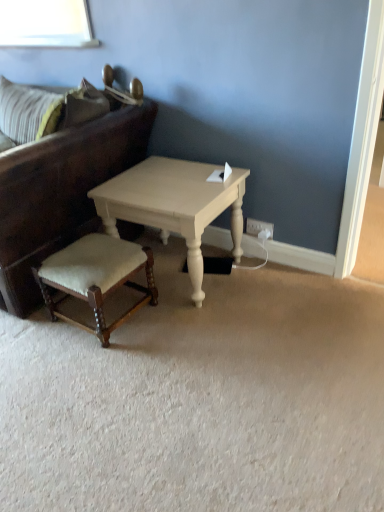
Find the location of a particular element. This screenshot has height=512, width=384. dark brown leather studio couch at left is located at coordinates (65, 181).

Measure the distance between white painted wood coffee table at center and camera.

The depth of white painted wood coffee table at center is 5.34 feet.

Locate an element on the screen. Image resolution: width=384 pixels, height=512 pixels. white plastic electric outlet at lower right is located at coordinates (258, 227).

From the picture: In terms of width, does white plastic electric outlet at lower right look wider or thinner when compared to velvet beige stool at lower left?

Clearly, white plastic electric outlet at lower right has less width compared to velvet beige stool at lower left.

Considering the points (257, 226) and (118, 322), which point is behind, point (257, 226) or point (118, 322)?

The point (257, 226) is behind.

Can you confirm if white plastic electric outlet at lower right is smaller than velvet beige stool at lower left?

Yes, white plastic electric outlet at lower right is smaller than velvet beige stool at lower left.

What's the angular difference between white plastic electric outlet at lower right and velvet beige stool at lower left's facing directions?

The angle between the facing direction of white plastic electric outlet at lower right and the facing direction of velvet beige stool at lower left is 0.702 degrees.

Could you tell me if velvet beige stool at lower left is turned towards white painted wood coffee table at center?

No.

Is velvet beige stool at lower left beside white painted wood coffee table at center?

velvet beige stool at lower left is not next to white painted wood coffee table at center, and they're not touching.

Is velvet beige stool at lower left in front of or behind white painted wood coffee table at center in the image?

In the image, velvet beige stool at lower left appears in front of white painted wood coffee table at center.

Between point (249, 221) and point (64, 184), which one is positioned behind?

Point (249, 221)

From the image's perspective, would you say white plastic electric outlet at lower right is shown under dark brown leather studio couch at left?

Indeed, from the image's perspective, white plastic electric outlet at lower right is shown beneath dark brown leather studio couch at left.

Is white plastic electric outlet at lower right located outside dark brown leather studio couch at left?

That's correct, white plastic electric outlet at lower right is outside of dark brown leather studio couch at left.

From their relative heights in the image, would you say white plastic electric outlet at lower right is taller or shorter than dark brown leather studio couch at left?

Considering their sizes, white plastic electric outlet at lower right has less height than dark brown leather studio couch at left.

How distant is white painted wood coffee table at center from velvet beige stool at lower left?

11.46 inches.

From the image's perspective, would you say white painted wood coffee table at center is shown under velvet beige stool at lower left?

No.

Considering the relative positions of white painted wood coffee table at center and velvet beige stool at lower left in the image provided, is white painted wood coffee table at center to the left of velvet beige stool at lower left from the viewer's perspective?

No.

Is white painted wood coffee table at center behind velvet beige stool at lower left?

That is True.

From a real-world perspective, who is located lower, velvet beige stool at lower left or white plastic electric outlet at lower right?

velvet beige stool at lower left.

This screenshot has width=384, height=512. I want to click on electric outlet lying on the right of velvet beige stool at lower left, so coord(258,227).

Who is more distant, velvet beige stool at lower left or white plastic electric outlet at lower right?

white plastic electric outlet at lower right is behind.

Is the surface of white painted wood coffee table at center in direct contact with dark brown leather studio couch at left?

No.

Does white painted wood coffee table at center have a greater width compared to dark brown leather studio couch at left?

Incorrect, the width of white painted wood coffee table at center does not surpass that of dark brown leather studio couch at left.

From the image's perspective, is white painted wood coffee table at center above or below dark brown leather studio couch at left?

→ white painted wood coffee table at center is below dark brown leather studio couch at left.

Based on the photo, between white painted wood coffee table at center and dark brown leather studio couch at left, which one is positioned in front?

dark brown leather studio couch at left is in front.

How many degrees apart are the facing directions of white plastic electric outlet at lower right and white painted wood coffee table at center?

There is a 0.978-degree angle between the facing directions of white plastic electric outlet at lower right and white painted wood coffee table at center.

Is white plastic electric outlet at lower right not within white painted wood coffee table at center?

white plastic electric outlet at lower right is positioned outside white painted wood coffee table at center.

Considering the relative positions of white plastic electric outlet at lower right and white painted wood coffee table at center in the image provided, is white plastic electric outlet at lower right to the left of white painted wood coffee table at center from the viewer's perspective?

No.

In the image, there is a velvet beige stool at lower left. At what (x,y) coordinates should I click in order to perform the action: click on electric outlet above it (from the image's perspective). Please return your answer as a coordinate pair (x, y). The width and height of the screenshot is (384, 512). Looking at the image, I should click on (258, 227).

Where is `stool that is in front of the white painted wood coffee table at center`? stool that is in front of the white painted wood coffee table at center is located at coordinates (96, 277).

From the image, which object appears to be farther from white painted wood coffee table at center, dark brown leather studio couch at left or white plastic electric outlet at lower right?

Among the two, white plastic electric outlet at lower right is located further to white painted wood coffee table at center.

Looking at the image, which one is located further to dark brown leather studio couch at left, white painted wood coffee table at center or white plastic electric outlet at lower right?

white plastic electric outlet at lower right is further to dark brown leather studio couch at left.

Based on their spatial positions, is white painted wood coffee table at center or dark brown leather studio couch at left closer to velvet beige stool at lower left?

Among the two, white painted wood coffee table at center is located nearer to velvet beige stool at lower left.

Which object lies further to the anchor point velvet beige stool at lower left, white plastic electric outlet at lower right or white painted wood coffee table at center?

white plastic electric outlet at lower right is positioned further to the anchor velvet beige stool at lower left.

Considering their positions, is white painted wood coffee table at center positioned further to white plastic electric outlet at lower right than dark brown leather studio couch at left?

The object further to white plastic electric outlet at lower right is dark brown leather studio couch at left.

Consider the image. Based on their spatial positions, is velvet beige stool at lower left or white plastic electric outlet at lower right closer to white painted wood coffee table at center?

The object closer to white painted wood coffee table at center is velvet beige stool at lower left.

Considering their positions, is dark brown leather studio couch at left positioned further to velvet beige stool at lower left than white painted wood coffee table at center?

Result: dark brown leather studio couch at left is positioned further to the anchor velvet beige stool at lower left.

From the picture: Estimate the real-world distances between objects in this image. Which object is closer to white painted wood coffee table at center, velvet beige stool at lower left or dark brown leather studio couch at left?

The object closer to white painted wood coffee table at center is velvet beige stool at lower left.

I want to click on stool between dark brown leather studio couch at left and white plastic electric outlet at lower right, so click(96, 277).

In order to click on coffee table located between velvet beige stool at lower left and white plastic electric outlet at lower right in the left-right direction in this screenshot , I will do [x=174, y=205].

Find the location of a particular element. This screenshot has height=512, width=384. coffee table between dark brown leather studio couch at left and white plastic electric outlet at lower right from left to right is located at coordinates (174, 205).

This screenshot has height=512, width=384. I want to click on stool between dark brown leather studio couch at left and white painted wood coffee table at center in the horizontal direction, so click(x=96, y=277).